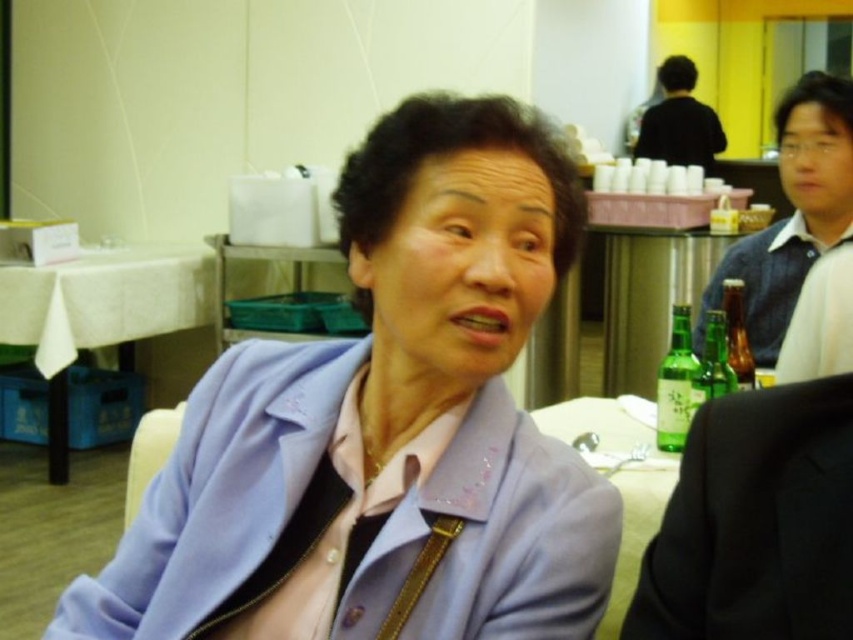
You are standing at the entrance of the event venue and see two points in the image, point (722, 244) and point (624, 492). Which point is closer to you?

Point (722, 244) is further to the viewer than point (624, 492), so the closer point to you is point (624, 492).

You are standing at the point with coordinates point (769, 284) and want to walk towards the point with coordinates point (33, 276). Will you be moving forward or backward?

Since point (33, 276) is behind point (769, 284), moving towards it would mean you are moving backward.